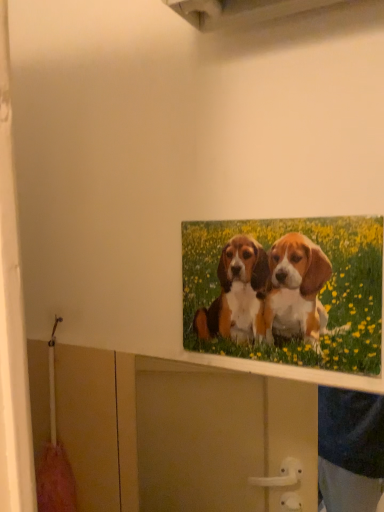
In order to face printed canvas puppies at upper center, should I rotate leftwards or rightwards?

To align with it, rotate right about 10.384°.

Image resolution: width=384 pixels, height=512 pixels. Find the location of `printed canvas puppies at upper center`. printed canvas puppies at upper center is located at coordinates (286, 290).

Describe the element at coordinates (286, 290) in the screenshot. Image resolution: width=384 pixels, height=512 pixels. I see `printed canvas puppies at upper center` at that location.

This screenshot has width=384, height=512. What do you see at coordinates (211, 437) in the screenshot? I see `matte white cabinet at upper center` at bounding box center [211, 437].

Locate an element on the screen. This screenshot has width=384, height=512. matte white cabinet at upper center is located at coordinates (211, 437).

Locate an element on the screen. The image size is (384, 512). printed canvas puppies at upper center is located at coordinates (286, 290).

Considering the relative positions of matte white cabinet at upper center and printed canvas puppies at upper center in the image provided, is matte white cabinet at upper center to the left of printed canvas puppies at upper center from the viewer's perspective?

Yes.

Is matte white cabinet at upper center in front of printed canvas puppies at upper center?

Yes.

Which is behind, point (231, 402) or point (208, 229)?

The point (231, 402) is more distant.

From the image's perspective, who appears lower, matte white cabinet at upper center or printed canvas puppies at upper center?

matte white cabinet at upper center.

From a real-world perspective, between matte white cabinet at upper center and printed canvas puppies at upper center, who is vertically lower?

matte white cabinet at upper center is physically lower.

Considering the relative sizes of matte white cabinet at upper center and printed canvas puppies at upper center in the image provided, is matte white cabinet at upper center wider than printed canvas puppies at upper center?

Yes, matte white cabinet at upper center is wider than printed canvas puppies at upper center.

Between matte white cabinet at upper center and printed canvas puppies at upper center, which one has more height?

With more height is matte white cabinet at upper center.

Does matte white cabinet at upper center have a larger size compared to printed canvas puppies at upper center?

Indeed, matte white cabinet at upper center has a larger size compared to printed canvas puppies at upper center.

Is printed canvas puppies at upper center located within matte white cabinet at upper center?

No, printed canvas puppies at upper center is not a part of matte white cabinet at upper center.

Can you see matte white cabinet at upper center touching printed canvas puppies at upper center?

matte white cabinet at upper center and printed canvas puppies at upper center are clearly separated.

Is matte white cabinet at upper center facing towards printed canvas puppies at upper center?

No, matte white cabinet at upper center is not oriented towards printed canvas puppies at upper center.

Can you tell me how much matte white cabinet at upper center and printed canvas puppies at upper center differ in facing direction?

0.000561 degrees.

This screenshot has width=384, height=512. I want to click on cabinet that appears below the printed canvas puppies at upper center (from a real-world perspective), so click(x=211, y=437).

Can you confirm if printed canvas puppies at upper center is positioned to the right of matte white cabinet at upper center?

Yes.

Considering their positions, is printed canvas puppies at upper center located in front of or behind matte white cabinet at upper center?

Clearly, printed canvas puppies at upper center is behind matte white cabinet at upper center.

Considering the positions of point (311, 335) and point (170, 511), is point (311, 335) closer or farther from the camera than point (170, 511)?

Clearly, point (311, 335) is closer to the camera than point (170, 511).

From the image's perspective, is printed canvas puppies at upper center located above or below matte white cabinet at upper center?

printed canvas puppies at upper center is situated higher than matte white cabinet at upper center in the image.

From a real-world perspective, is printed canvas puppies at upper center positioned under matte white cabinet at upper center based on gravity?

No.

Between printed canvas puppies at upper center and matte white cabinet at upper center, which one has smaller width?

printed canvas puppies at upper center.

In terms of height, does printed canvas puppies at upper center look taller or shorter compared to matte white cabinet at upper center?

printed canvas puppies at upper center is shorter than matte white cabinet at upper center.

Between printed canvas puppies at upper center and matte white cabinet at upper center, which one has larger size?

matte white cabinet at upper center.

Is matte white cabinet at upper center inside printed canvas puppies at upper center?

No, matte white cabinet at upper center is not a part of printed canvas puppies at upper center.

Are printed canvas puppies at upper center and matte white cabinet at upper center located far from each other?

No, printed canvas puppies at upper center is not far away from matte white cabinet at upper center.

Is printed canvas puppies at upper center facing towards matte white cabinet at upper center?

No, printed canvas puppies at upper center is not oriented towards matte white cabinet at upper center.

How distant is printed canvas puppies at upper center from matte white cabinet at upper center?

printed canvas puppies at upper center is 18.20 inches from matte white cabinet at upper center.

What are the coordinates of `picture frame lying above the matte white cabinet at upper center (from the image's perspective)` in the screenshot? It's located at (286, 290).

Where is `picture frame above the matte white cabinet at upper center (from a real-world perspective)`? Image resolution: width=384 pixels, height=512 pixels. picture frame above the matte white cabinet at upper center (from a real-world perspective) is located at coordinates (286, 290).

Where is `cabinet in front of the printed canvas puppies at upper center`? This screenshot has width=384, height=512. cabinet in front of the printed canvas puppies at upper center is located at coordinates (211, 437).